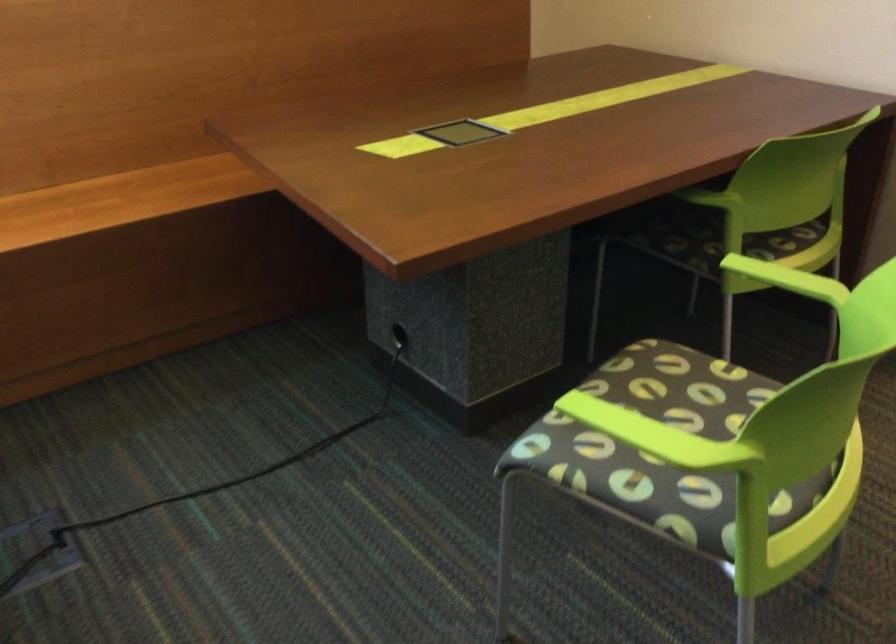
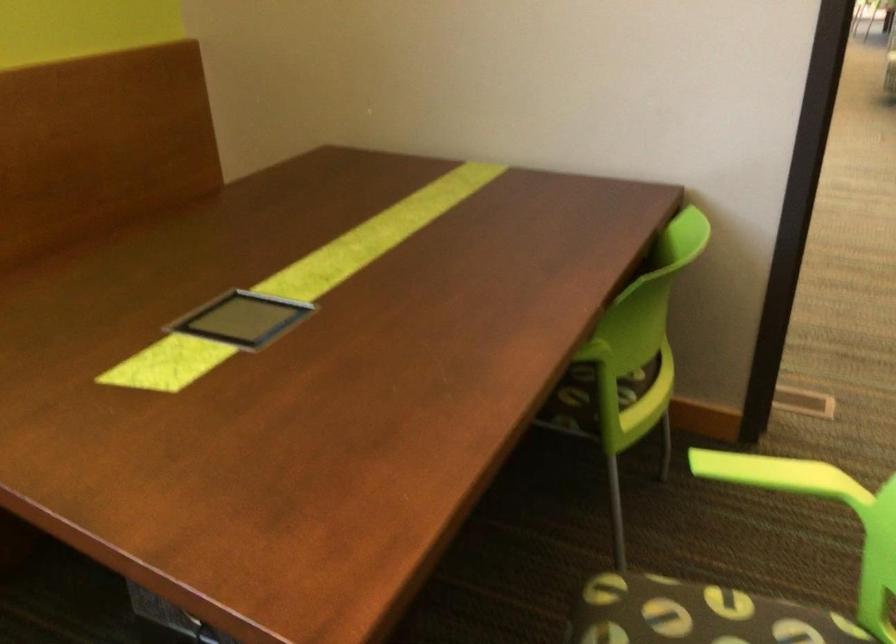
Which direction would the cameraman need to move to produce the second image?

The cameraman moved toward left, forward.